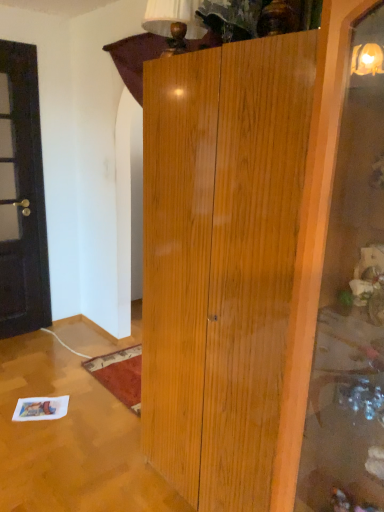
This screenshot has width=384, height=512. In order to click on matte brown lampshade at upper center in this screenshot , I will do `click(174, 22)`.

What do you see at coordinates (174, 22) in the screenshot?
I see `matte brown lampshade at upper center` at bounding box center [174, 22].

Image resolution: width=384 pixels, height=512 pixels. What do you see at coordinates (22, 196) in the screenshot?
I see `dark brown wooden door at left` at bounding box center [22, 196].

Find the location of `dark brown wooden door at left`. dark brown wooden door at left is located at coordinates (22, 196).

What are the coordinates of `matte brown lampshade at upper center` in the screenshot? It's located at (174, 22).

Is dark brown wooden door at left to the right of matte brown lampshade at upper center from the viewer's perspective?

No, dark brown wooden door at left is not to the right of matte brown lampshade at upper center.

Relative to matte brown lampshade at upper center, is dark brown wooden door at left in front or behind?

dark brown wooden door at left is behind matte brown lampshade at upper center.

Which is nearer, (16, 329) or (144, 18)?

Point (144, 18)

From the image's perspective, who appears lower, dark brown wooden door at left or matte brown lampshade at upper center?

dark brown wooden door at left is shown below in the image.

From a real-world perspective, which is physically above, dark brown wooden door at left or matte brown lampshade at upper center?

matte brown lampshade at upper center, from a real-world perspective.

Considering the sizes of objects dark brown wooden door at left and matte brown lampshade at upper center in the image provided, who is wider, dark brown wooden door at left or matte brown lampshade at upper center?

With larger width is matte brown lampshade at upper center.

Looking at this image, between dark brown wooden door at left and matte brown lampshade at upper center, which one has less height?

matte brown lampshade at upper center.

In the scene shown: Between dark brown wooden door at left and matte brown lampshade at upper center, which one has smaller size?

With smaller size is matte brown lampshade at upper center.

Could matte brown lampshade at upper center be considered to be inside dark brown wooden door at left?

Actually, matte brown lampshade at upper center is outside dark brown wooden door at left.

Is dark brown wooden door at left far away from matte brown lampshade at upper center?

That's right, there is a large distance between dark brown wooden door at left and matte brown lampshade at upper center.

Is dark brown wooden door at left aimed at matte brown lampshade at upper center?

Yes, dark brown wooden door at left faces towards matte brown lampshade at upper center.

You are a GUI agent. You are given a task and a screenshot of the screen. Output one action in this format:
    pyautogui.click(x=<x>, y=<y>)
    Task: Click on the door that appears below the matte brown lampshade at upper center (from a real-world perspective)
    This screenshot has width=384, height=512.
    Given the screenshot: What is the action you would take?
    pyautogui.click(x=22, y=196)

Considering the relative positions of matte brown lampshade at upper center and dark brown wooden door at left in the image provided, is matte brown lampshade at upper center to the left of dark brown wooden door at left from the viewer's perspective?

No.

Is matte brown lampshade at upper center positioned in front of dark brown wooden door at left?

Yes, it is.

Is point (158, 17) farther from viewer compared to point (2, 322)?

No, (158, 17) is in front of (2, 322).

From the image's perspective, is matte brown lampshade at upper center under dark brown wooden door at left?

No, from the image's perspective, matte brown lampshade at upper center is not beneath dark brown wooden door at left.

In the scene shown: From a real-world perspective, is matte brown lampshade at upper center below dark brown wooden door at left?

Incorrect, from a real-world perspective, matte brown lampshade at upper center is higher than dark brown wooden door at left.

Can you confirm if matte brown lampshade at upper center is wider than dark brown wooden door at left?

Correct, the width of matte brown lampshade at upper center exceeds that of dark brown wooden door at left.

Considering the sizes of objects matte brown lampshade at upper center and dark brown wooden door at left in the image provided, who is shorter, matte brown lampshade at upper center or dark brown wooden door at left?

With less height is matte brown lampshade at upper center.

Looking at the image, does matte brown lampshade at upper center seem bigger or smaller compared to dark brown wooden door at left?

matte brown lampshade at upper center is smaller than dark brown wooden door at left.

Is matte brown lampshade at upper center surrounding dark brown wooden door at left?

No, dark brown wooden door at left is located outside of matte brown lampshade at upper center.

Would you say matte brown lampshade at upper center is a long distance from dark brown wooden door at left?

Indeed, matte brown lampshade at upper center is not near dark brown wooden door at left.

Is matte brown lampshade at upper center oriented away from dark brown wooden door at left?

matte brown lampshade at upper center does not have its back to dark brown wooden door at left.

Can you tell me how much matte brown lampshade at upper center and dark brown wooden door at left differ in facing direction?

90.3 degrees separate the facing orientations of matte brown lampshade at upper center and dark brown wooden door at left.

Where is `lamp lying in front of the dark brown wooden door at left`? This screenshot has width=384, height=512. lamp lying in front of the dark brown wooden door at left is located at coordinates point(174,22).

Locate an element on the screen. This screenshot has width=384, height=512. lamp above the dark brown wooden door at left (from the image's perspective) is located at coordinates [x=174, y=22].

The height and width of the screenshot is (512, 384). I want to click on lamp above the dark brown wooden door at left (from a real-world perspective), so click(174, 22).